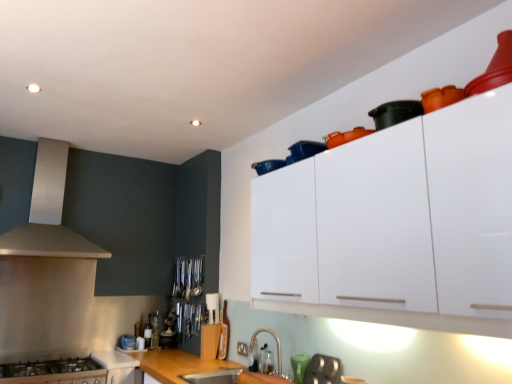
Describe the element at coordinates (419, 223) in the screenshot. I see `white glossy cabinet at upper right, acting as the 2th cabinetry starting from the back` at that location.

This screenshot has height=384, width=512. Identify the location of metallic silver utensils at center, arranged as the fourth appliance when viewed from the right. (188, 277).

How much space does orange matte pot at upper center, which is the 2th appliance in top-to-bottom order, occupy vertically?

It is 4.22 inches.

What do you see at coordinates (48, 213) in the screenshot?
I see `satin silver range hood at left` at bounding box center [48, 213].

Find the location of a particular element. white glossy cabinet at upper right, acting as the 2th cabinetry starting from the back is located at coordinates (419, 223).

From a real-world perspective, is satin nickel faucet at lower center beneath black plastic container at upper right, positioned as the first appliance in top-to-bottom order?

Yes.

Considering the positions of objects satin nickel faucet at lower center and black plastic container at upper right, which is counted as the 1th appliance, starting from the right, in the image provided, who is more to the right, satin nickel faucet at lower center or black plastic container at upper right, which is counted as the 1th appliance, starting from the right,?

Positioned to the right is black plastic container at upper right, which is counted as the 1th appliance, starting from the right.

Is satin nickel faucet at lower center aimed at black plastic container at upper right, the 4th appliance in the bottom-to-top sequence?

No, satin nickel faucet at lower center is not oriented towards black plastic container at upper right, the 4th appliance in the bottom-to-top sequence.

From the image's perspective, which object appears higher, satin nickel faucet at lower center or black plastic container at upper right, the 4th appliance from the back?

black plastic container at upper right, the 4th appliance from the back, is shown above in the image.

Is satin nickel faucet at lower center further to the viewer compared to metallic gray toaster at lower center, which ranks as the 2th appliance in back-to-front order?

Yes, it is behind metallic gray toaster at lower center, which ranks as the 2th appliance in back-to-front order.

Between point (279, 350) and point (323, 378), which one is positioned behind?

The point (279, 350) is farther from the camera.

From the image's perspective, is satin nickel faucet at lower center under metallic gray toaster at lower center, the fourth appliance in the top-to-bottom sequence?

No, from the image's perspective, satin nickel faucet at lower center is not beneath metallic gray toaster at lower center, the fourth appliance in the top-to-bottom sequence.

From a real-world perspective, is satin nickel faucet at lower center physically located above or below metallic gray toaster at lower center, arranged as the 2th appliance when viewed from the left?

satin nickel faucet at lower center is above metallic gray toaster at lower center, arranged as the 2th appliance when viewed from the left.

How many degrees apart are the facing directions of satin nickel faucet at lower center and stainless steel stove at lower left, positioned as the 1th cabinetry in left-to-right order?

The angle between the facing direction of satin nickel faucet at lower center and the facing direction of stainless steel stove at lower left, positioned as the 1th cabinetry in left-to-right order, is 94.4 degrees.

Can you confirm if satin nickel faucet at lower center is wider than stainless steel stove at lower left, positioned as the 1th cabinetry in left-to-right order?

Incorrect, the width of satin nickel faucet at lower center does not surpass that of stainless steel stove at lower left, positioned as the 1th cabinetry in left-to-right order.

From the image's perspective, is satin nickel faucet at lower center on top of stainless steel stove at lower left, positioned as the 2th cabinetry in right-to-left order?

Yes, from the image's perspective, satin nickel faucet at lower center is above stainless steel stove at lower left, positioned as the 2th cabinetry in right-to-left order.

Do you think satin nickel faucet at lower center is within stainless steel stove at lower left, positioned as the 1th cabinetry in left-to-right order, or outside of it?

satin nickel faucet at lower center exists outside the volume of stainless steel stove at lower left, positioned as the 1th cabinetry in left-to-right order.

Consider the image. Looking at their sizes, would you say satin silver range hood at left is wider or thinner than teal glass at lower center?

satin silver range hood at left is wider than teal glass at lower center.

Based on their sizes in the image, would you say satin silver range hood at left is bigger or smaller than teal glass at lower center?

Considering their sizes, satin silver range hood at left takes up more space than teal glass at lower center.

Is satin silver range hood at left far away from teal glass at lower center?

Absolutely, satin silver range hood at left is distant from teal glass at lower center.

Is wooden at lower center further to camera compared to white glossy cabinet at upper right, the 1th cabinetry when ordered from top to bottom?

Yes.

Is wooden at lower center positioned far away from white glossy cabinet at upper right, acting as the 2th cabinetry starting from the left?

Yes, wooden at lower center and white glossy cabinet at upper right, acting as the 2th cabinetry starting from the left, are located far from each other.

From the image's perspective, does wooden at lower center appear higher than white glossy cabinet at upper right, the second cabinetry in the bottom-to-top sequence?

No, from the image's perspective, wooden at lower center is not on top of white glossy cabinet at upper right, the second cabinetry in the bottom-to-top sequence.

Is white glossy cabinet at upper right, acting as the 2th cabinetry starting from the back, surrounded by wooden at lower center?

No, white glossy cabinet at upper right, acting as the 2th cabinetry starting from the back, is not inside wooden at lower center.

From the image's perspective, which object appears higher, stainless steel stove at lower left, positioned as the 1th cabinetry in left-to-right order, or metallic gray toaster at lower center, arranged as the 2th appliance when viewed from the left?

From the image's view, metallic gray toaster at lower center, arranged as the 2th appliance when viewed from the left, is above.

Is stainless steel stove at lower left, positioned as the 1th cabinetry in back-to-front order, smaller than metallic gray toaster at lower center, which ranks as the 2th appliance in back-to-front order?

Incorrect, stainless steel stove at lower left, positioned as the 1th cabinetry in back-to-front order, is not smaller in size than metallic gray toaster at lower center, which ranks as the 2th appliance in back-to-front order.

Would you say stainless steel stove at lower left, which is the second cabinetry from front to back, is a long distance from metallic gray toaster at lower center, arranged as the 2th appliance when viewed from the left?

Indeed, stainless steel stove at lower left, which is the second cabinetry from front to back, is not near metallic gray toaster at lower center, arranged as the 2th appliance when viewed from the left.

Based on their positions, is stainless steel stove at lower left, positioned as the 2th cabinetry in right-to-left order, located to the left or right of metallic gray toaster at lower center, which ranks as the 2th appliance in back-to-front order?

From the image, it's evident that stainless steel stove at lower left, positioned as the 2th cabinetry in right-to-left order, is to the left of metallic gray toaster at lower center, which ranks as the 2th appliance in back-to-front order.

Does point (331, 374) appear closer or farther from the camera than point (139, 366)?

Clearly, point (331, 374) is closer to the camera than point (139, 366).

Is metallic gray toaster at lower center, which is the 3th appliance from front to back, positioned with its back to wooden at lower center?

That's not correct — metallic gray toaster at lower center, which is the 3th appliance from front to back, is not looking away from wooden at lower center.

From a real-world perspective, is metallic gray toaster at lower center, the fourth appliance in the top-to-bottom sequence, below wooden at lower center?

No.

Locate an element on the screen. the 3rd appliance to the right of the satin nickel faucet at lower center, counting from the anchor's position is located at coordinates (395, 113).

At what (x,y) coordinates should I click in order to perform the action: click on faucet above the metallic gray toaster at lower center, the fourth appliance in the top-to-bottom sequence (from a real-world perspective). Please return your answer as a coordinate pair (x, y). Looking at the image, I should click on (276, 343).

Considering their positions, is stainless steel stove at lower left, which is the second cabinetry from front to back, positioned further to orange matte pot at upper center, which is counted as the 3th appliance, starting from the back, than wooden at lower center?

stainless steel stove at lower left, which is the second cabinetry from front to back, is further to orange matte pot at upper center, which is counted as the 3th appliance, starting from the back.

Estimate the real-world distances between objects in this image. Which object is further from white glossy cabinet at upper right, which is the first cabinetry from right to left, wooden at lower center or metallic silver utensils at center, the 4th appliance positioned from the front?

metallic silver utensils at center, the 4th appliance positioned from the front, lies further to white glossy cabinet at upper right, which is the first cabinetry from right to left, than the other object.

When comparing their distances from satin silver range hood at left, does satin nickel faucet at lower center or stainless steel stove at lower left, positioned as the 2th cabinetry in right-to-left order, seem closer?

stainless steel stove at lower left, positioned as the 2th cabinetry in right-to-left order, is positioned closer to the anchor satin silver range hood at left.

Based on their spatial positions, is satin silver range hood at left or stainless steel stove at lower left, positioned as the 1th cabinetry in back-to-front order, closer to satin nickel faucet at lower center?

stainless steel stove at lower left, positioned as the 1th cabinetry in back-to-front order, lies closer to satin nickel faucet at lower center than the other object.

Looking at this image, from the image, which object appears to be nearer to wooden at lower center, metallic silver utensils at center, the first appliance in the back-to-front sequence, or satin silver range hood at left?

Among the two, metallic silver utensils at center, the first appliance in the back-to-front sequence, is located nearer to wooden at lower center.

From the picture: When comparing their distances from teal glass at lower center, does stainless steel stove at lower left, the first cabinetry positioned from the bottom, or orange matte pot at upper center, which is counted as the 3th appliance, starting from the back, seem closer?

Among the two, orange matte pot at upper center, which is counted as the 3th appliance, starting from the back, is located nearer to teal glass at lower center.

Considering their positions, is orange matte pot at upper center, which is counted as the 3th appliance, starting from the back, positioned further to satin silver range hood at left than stainless steel stove at lower left, the first cabinetry positioned from the bottom?

orange matte pot at upper center, which is counted as the 3th appliance, starting from the back, is positioned further to the anchor satin silver range hood at left.

From the image, which object appears to be farther from orange matte pot at upper center, which is counted as the 3th appliance, starting from the back, wooden at lower center or satin silver range hood at left?

Based on the image, satin silver range hood at left appears to be further to orange matte pot at upper center, which is counted as the 3th appliance, starting from the back.

You are a GUI agent. You are given a task and a screenshot of the screen. Output one action in this format:
    pyautogui.click(x=<x>, y=<y>)
    Task: Click on the countertop located between metallic gray toaster at lower center, which ranks as the 2th appliance in back-to-front order, and metallic silver utensils at center, the first appliance in the back-to-front sequence, in the depth direction
    
    Given the screenshot: What is the action you would take?
    pyautogui.click(x=191, y=367)

Locate an element on the screen. This screenshot has width=512, height=384. teal located between satin silver range hood at left and black plastic container at upper right, which is counted as the 1th appliance, starting from the right, in the left-right direction is located at coordinates (298, 366).

The height and width of the screenshot is (384, 512). What are the coordinates of `cabinetry between orange matte pot at upper center, which is the 3th appliance from bottom to top, and teal glass at lower center vertically` in the screenshot? It's located at (419, 223).

Identify the location of faucet between white glossy cabinet at upper right, acting as the 2th cabinetry starting from the back, and metallic silver utensils at center, arranged as the 2th appliance when ordered from the bottom, in the front-back direction. This screenshot has width=512, height=384. coord(276,343).